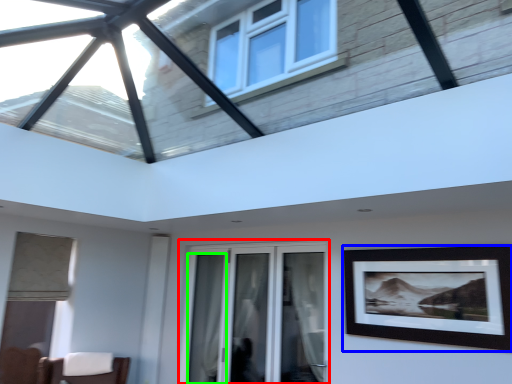
Question: Considering the real-world distances, which object is closest to window (highlighted by a red box)? picture frame (highlighted by a blue box) or curtain (highlighted by a green box).

Choices:
 (A) picture frame
 (B) curtain

Answer: (B)